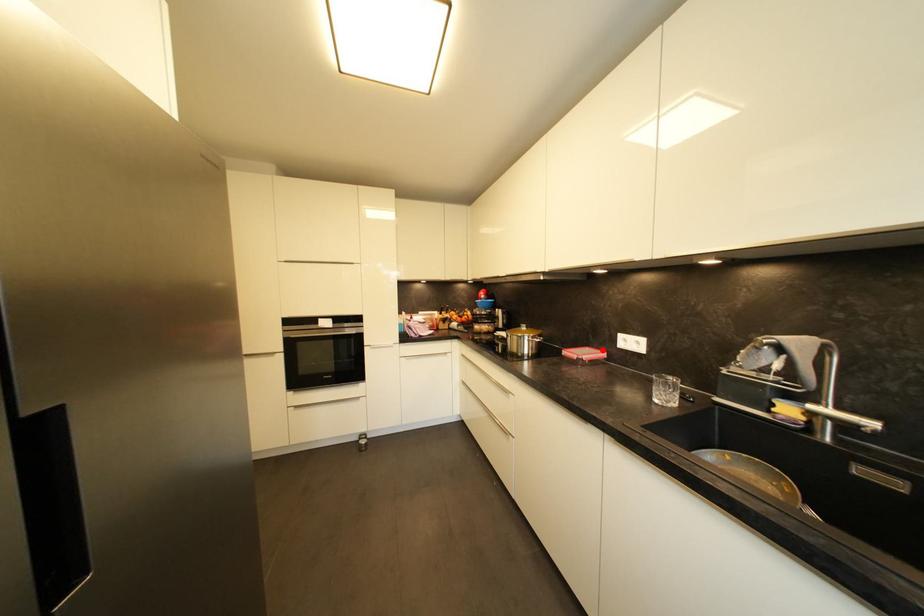
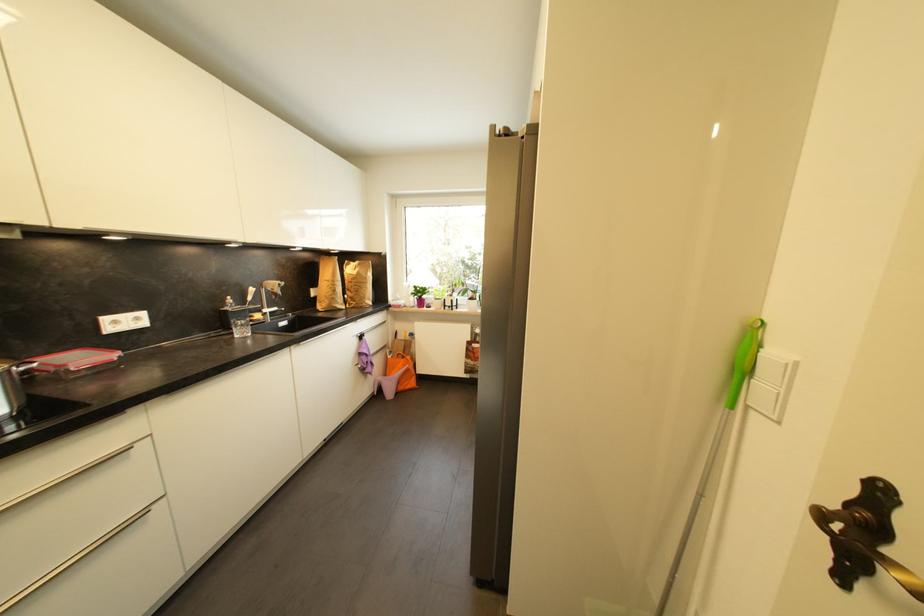
Question: I am providing you with two images of the same scene from different viewpoints. Given a red point in image1, look at the same physical point in image2. Is it:

Choices:
 (A) Closer to the viewpoint
 (B) Farther from the viewpoint

Answer: (B)